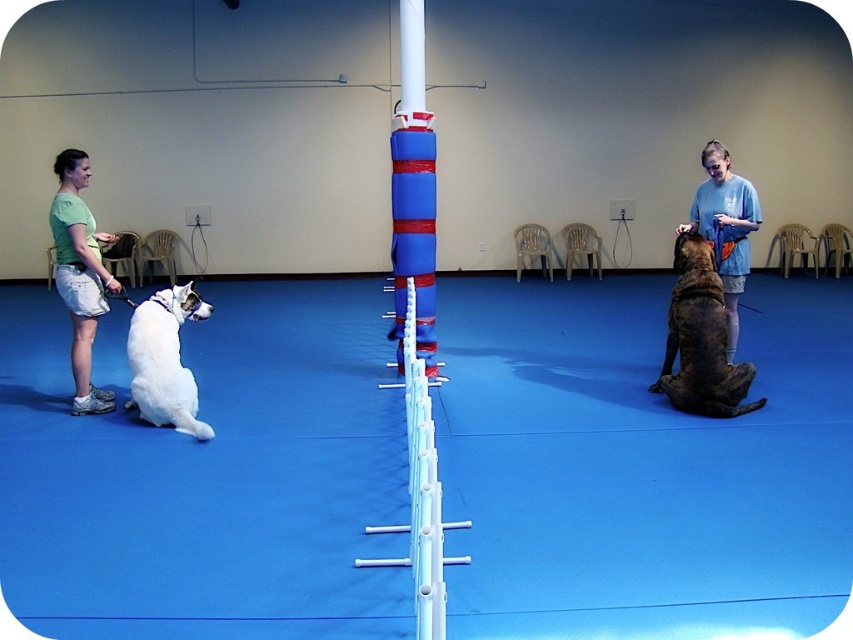
You are a trainer observing the indoor training session. You notice the green cotton shirt at left and the white fur dog at left. Which one is closer to the front of the scene?

The green cotton shirt at left is closer to the front of the scene because the white fur dog at left is behind it.

You are a dog trainer assessing the height of the two dogs in the training session. Which dog, the brown fur dog at right or the white fur dog at left, would require a higher platform for a training exercise?

The brown fur dog at right is much taller than the white fur dog at left, so it would require a higher platform for the training exercise.

What are the coordinates of the brown fur dog at right?

The brown fur dog at right is located at coordinates point (x=700, y=339).